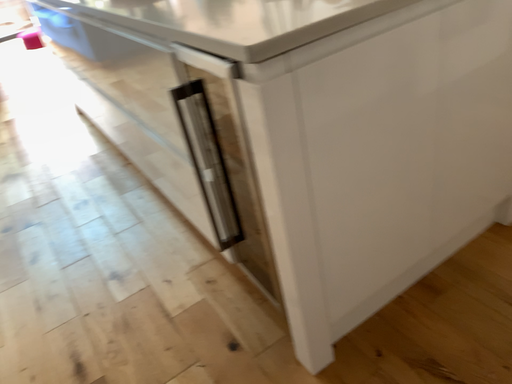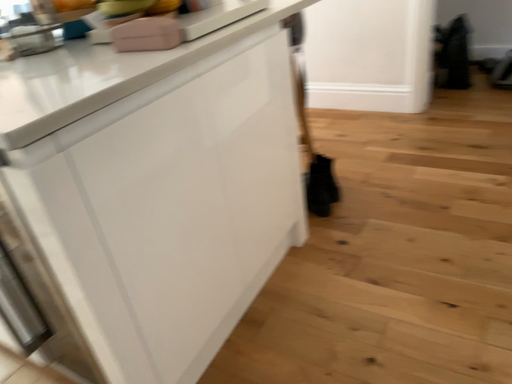
Question: How did the camera likely rotate when shooting the video?

Choices:
 (A) rotated left
 (B) rotated right

Answer: (B)